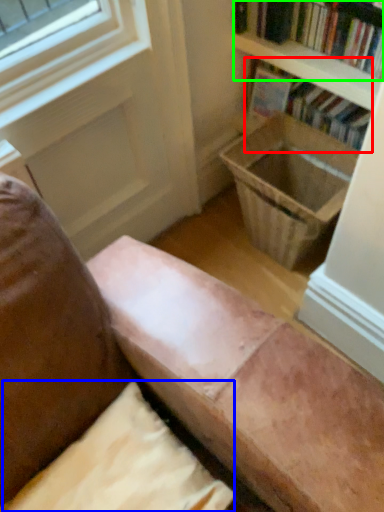
Question: Which object is positioned farthest from book (highlighted by a red box)? Select from pillow (highlighted by a blue box) and book (highlighted by a green box).

Choices:
 (A) pillow
 (B) book

Answer: (A)